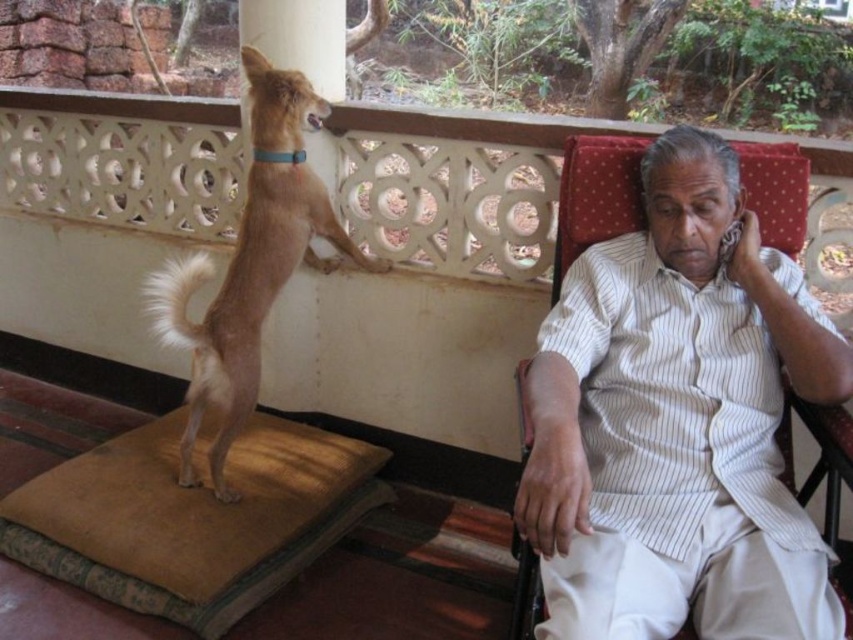
In the scene shown: Between white striped shirt at right and light brown fur dog at left, which one appears on the right side from the viewer's perspective?

white striped shirt at right is more to the right.

I want to click on white striped shirt at right, so click(677, 422).